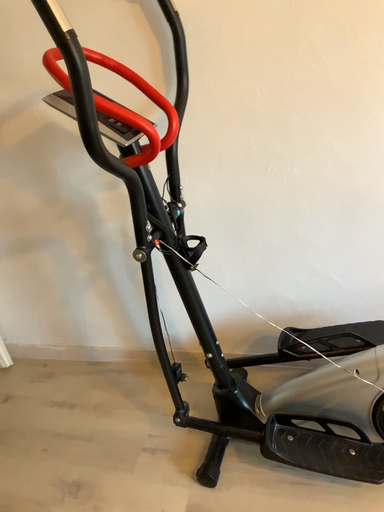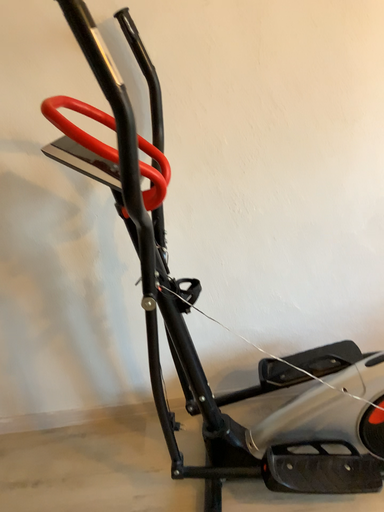
Question: Which way did the camera rotate in the video?

Choices:
 (A) rotated right
 (B) rotated left

Answer: (A)